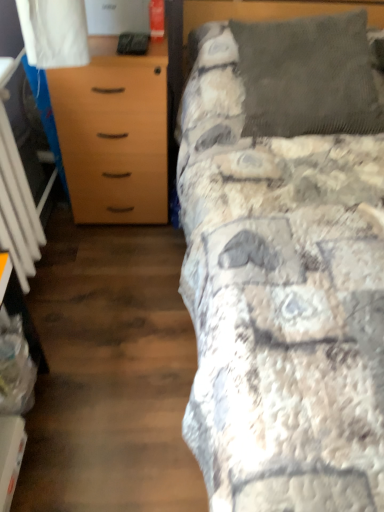
Where is `light brown wood chest of drawers at left`? light brown wood chest of drawers at left is located at coordinates (114, 133).

What's the angular difference between textured gray blanket at upper right and dark gray corduroy pillow at upper right's facing directions?

The angle between the facing direction of textured gray blanket at upper right and the facing direction of dark gray corduroy pillow at upper right is 0.000468 degrees.

Is textured gray blanket at upper right next to dark gray corduroy pillow at upper right and touching it?

They are not placed beside each other.

From the image's perspective, is textured gray blanket at upper right above or below dark gray corduroy pillow at upper right?

textured gray blanket at upper right is situated lower than dark gray corduroy pillow at upper right in the image.

Considering the positions of point (243, 36) and point (310, 22), is point (243, 36) closer or farther from the camera than point (310, 22)?

Point (243, 36) is positioned farther from the camera compared to point (310, 22).

Locate an element on the screen. The width and height of the screenshot is (384, 512). bed to the right of white plastic radiator at left is located at coordinates (284, 264).

Is there a large distance between textured gray blanket at upper right and white plastic radiator at left?

No, textured gray blanket at upper right is not far away from white plastic radiator at left.

Is the position of textured gray blanket at upper right less distant than that of white plastic radiator at left?

Yes, textured gray blanket at upper right is closer to the viewer.

Which is in front, light brown wood chest of drawers at left or textured gray blanket at upper right?

textured gray blanket at upper right.

From the picture: Measure the distance between light brown wood chest of drawers at left and textured gray blanket at upper right.

light brown wood chest of drawers at left is 51.26 centimeters away from textured gray blanket at upper right.

In the scene shown: Considering the sizes of objects light brown wood chest of drawers at left and textured gray blanket at upper right in the image provided, who is taller, light brown wood chest of drawers at left or textured gray blanket at upper right?

Standing taller between the two is textured gray blanket at upper right.

How many degrees apart are the facing directions of light brown wood chest of drawers at left and textured gray blanket at upper right?

light brown wood chest of drawers at left and textured gray blanket at upper right are facing 0.255 degrees away from each other.

The width and height of the screenshot is (384, 512). I want to click on chest of drawers located on the left of textured gray blanket at upper right, so click(114, 133).

From a real-world perspective, which object rests below the other?

light brown wood chest of drawers at left.

Is textured gray blanket at upper right looking in the opposite direction of light brown wood chest of drawers at left?

That's not correct — textured gray blanket at upper right is not looking away from light brown wood chest of drawers at left.

Can you confirm if textured gray blanket at upper right is thinner than light brown wood chest of drawers at left?

Incorrect, the width of textured gray blanket at upper right is not less than that of light brown wood chest of drawers at left.

You are a GUI agent. You are given a task and a screenshot of the screen. Output one action in this format:
    pyautogui.click(x=<x>, y=<y>)
    Task: Click on the chest of drawers below the dark gray corduroy pillow at upper right (from the image's perspective)
    
    Given the screenshot: What is the action you would take?
    pyautogui.click(x=114, y=133)

In the scene shown: Who is bigger, light brown wood chest of drawers at left or dark gray corduroy pillow at upper right?

light brown wood chest of drawers at left.

From the image's perspective, is light brown wood chest of drawers at left located above or below dark gray corduroy pillow at upper right?

From the image's perspective, light brown wood chest of drawers at left appears below dark gray corduroy pillow at upper right.

Considering the positions of points (142, 203) and (311, 94), is point (142, 203) farther from camera compared to point (311, 94)?

That is True.

Is dark gray corduroy pillow at upper right touching white plastic radiator at left?

No.

At what (x,y) coordinates should I click in order to perform the action: click on radiator on the left of dark gray corduroy pillow at upper right. Please return your answer as a coordinate pair (x, y). The image size is (384, 512). Looking at the image, I should click on (17, 208).

From the image's perspective, is dark gray corduroy pillow at upper right beneath white plastic radiator at left?

Incorrect, from the image's perspective, dark gray corduroy pillow at upper right is higher than white plastic radiator at left.

Which of these two, dark gray corduroy pillow at upper right or white plastic radiator at left, stands taller?

white plastic radiator at left.

Considering the relative sizes of light brown wood chest of drawers at left and white plastic radiator at left in the image provided, is light brown wood chest of drawers at left bigger than white plastic radiator at left?

Yes, light brown wood chest of drawers at left is bigger than white plastic radiator at left.

Is light brown wood chest of drawers at left to the right of white plastic radiator at left from the viewer's perspective?

Correct, you'll find light brown wood chest of drawers at left to the right of white plastic radiator at left.

Is point (122, 135) positioned after point (21, 199)?

Yes, it is.

Looking at this image, is light brown wood chest of drawers at left closer to the viewer compared to white plastic radiator at left?

No, the depth of light brown wood chest of drawers at left is greater than that of white plastic radiator at left.

In the image, there is a dark gray corduroy pillow at upper right. Where is `bed below it (from a real-world perspective)`? This screenshot has height=512, width=384. bed below it (from a real-world perspective) is located at coordinates (284, 264).

Locate an element on the screen. The width and height of the screenshot is (384, 512). bed above the white plastic radiator at left (from the image's perspective) is located at coordinates (284, 264).

Based on their spatial positions, is light brown wood chest of drawers at left or white plastic radiator at left closer to textured gray blanket at upper right?

light brown wood chest of drawers at left is closer to textured gray blanket at upper right.

When comparing their distances from white plastic radiator at left, does dark gray corduroy pillow at upper right or light brown wood chest of drawers at left seem further?

The object further to white plastic radiator at left is dark gray corduroy pillow at upper right.

From the image, which object appears to be nearer to light brown wood chest of drawers at left, dark gray corduroy pillow at upper right or white plastic radiator at left?

white plastic radiator at left is positioned closer to the anchor light brown wood chest of drawers at left.

Considering their positions, is white plastic radiator at left positioned further to textured gray blanket at upper right than dark gray corduroy pillow at upper right?

The object further to textured gray blanket at upper right is white plastic radiator at left.

Looking at the image, which one is located further to dark gray corduroy pillow at upper right, light brown wood chest of drawers at left or textured gray blanket at upper right?

light brown wood chest of drawers at left lies further to dark gray corduroy pillow at upper right than the other object.

Considering their positions, is textured gray blanket at upper right positioned further to white plastic radiator at left than light brown wood chest of drawers at left?

textured gray blanket at upper right is positioned further to the anchor white plastic radiator at left.

From the image, which object appears to be farther from white plastic radiator at left, light brown wood chest of drawers at left or textured gray blanket at upper right?

Among the two, textured gray blanket at upper right is located further to white plastic radiator at left.

Considering their positions, is white plastic radiator at left positioned further to textured gray blanket at upper right than light brown wood chest of drawers at left?

Among the two, white plastic radiator at left is located further to textured gray blanket at upper right.

At what (x,y) coordinates should I click in order to perform the action: click on pillow between white plastic radiator at left and textured gray blanket at upper right. Please return your answer as a coordinate pair (x, y). The height and width of the screenshot is (512, 384). Looking at the image, I should click on (308, 76).

Image resolution: width=384 pixels, height=512 pixels. I want to click on chest of drawers between white plastic radiator at left and dark gray corduroy pillow at upper right from left to right, so click(x=114, y=133).

The image size is (384, 512). What are the coordinates of `chest of drawers between white plastic radiator at left and textured gray blanket at upper right from left to right` in the screenshot? It's located at (114, 133).

Identify the location of pillow between textured gray blanket at upper right and light brown wood chest of drawers at left in the front-back direction. (308, 76).